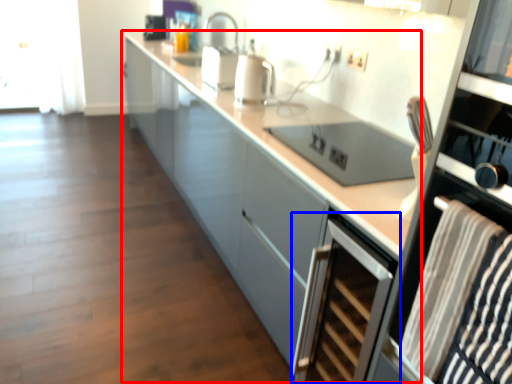
Question: Among these objects, which one is farthest to the camera, cabinetry (highlighted by a red box) or home appliance (highlighted by a blue box)?

Choices:
 (A) cabinetry
 (B) home appliance

Answer: (B)